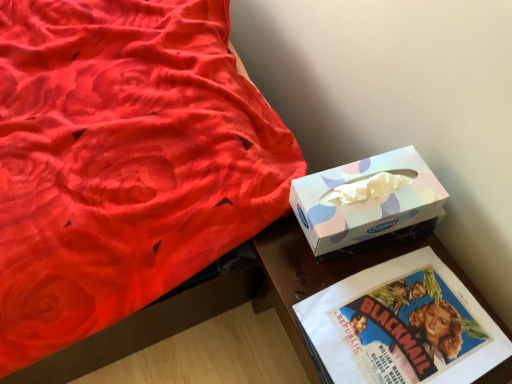
Find the location of a particular element. The height and width of the screenshot is (384, 512). empty space that is ontop of pastel paper tissue box at right is located at coordinates coord(369,184).